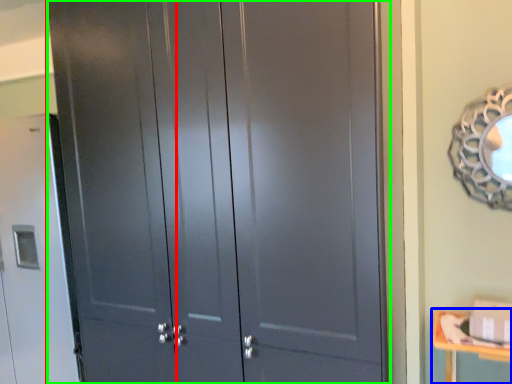
Question: Which is farther away from screen door (highlighted by a red box)? changing table (highlighted by a blue box) or door (highlighted by a green box)?

Choices:
 (A) changing table
 (B) door

Answer: (A)